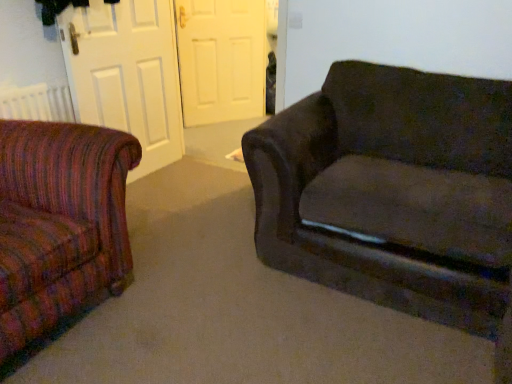
You are a GUI agent. You are given a task and a screenshot of the screen. Output one action in this format:
    pyautogui.click(x=<x>, y=<y>)
    Task: Click on the blank area to the left of dark fabric couch at right
    The height and width of the screenshot is (384, 512).
    Given the screenshot: What is the action you would take?
    pyautogui.click(x=165, y=265)